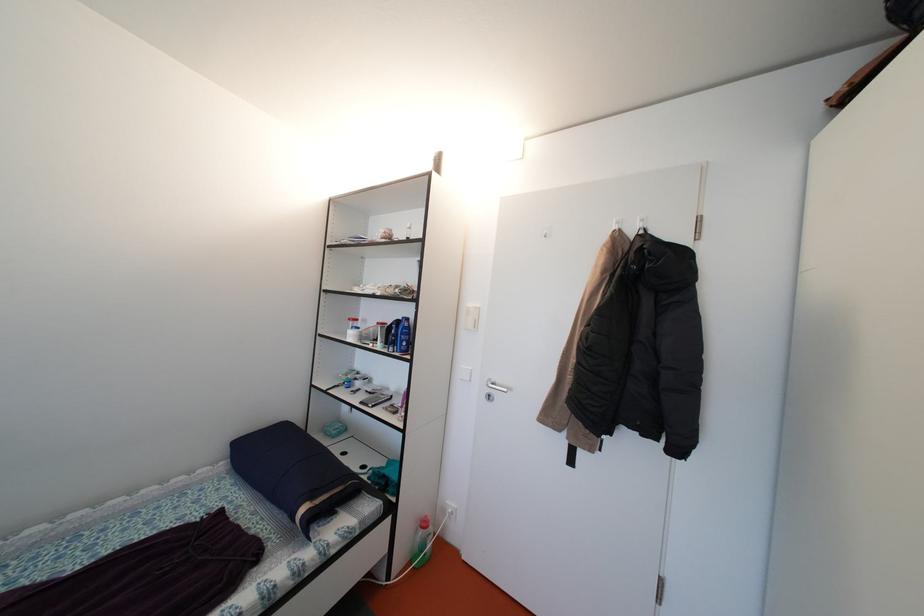
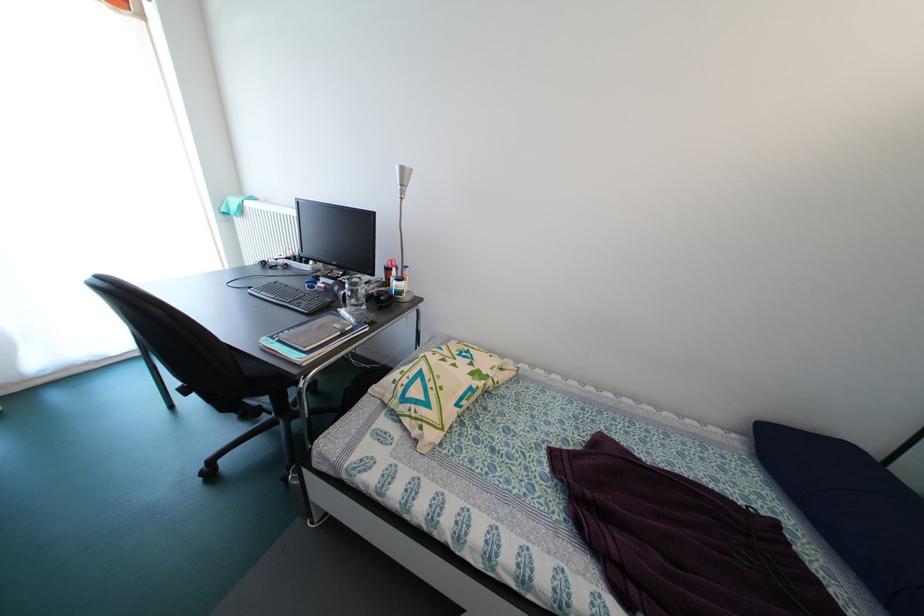
Based on the continuous images, in which direction is the camera rotating?

The camera's rotation is toward left-down.